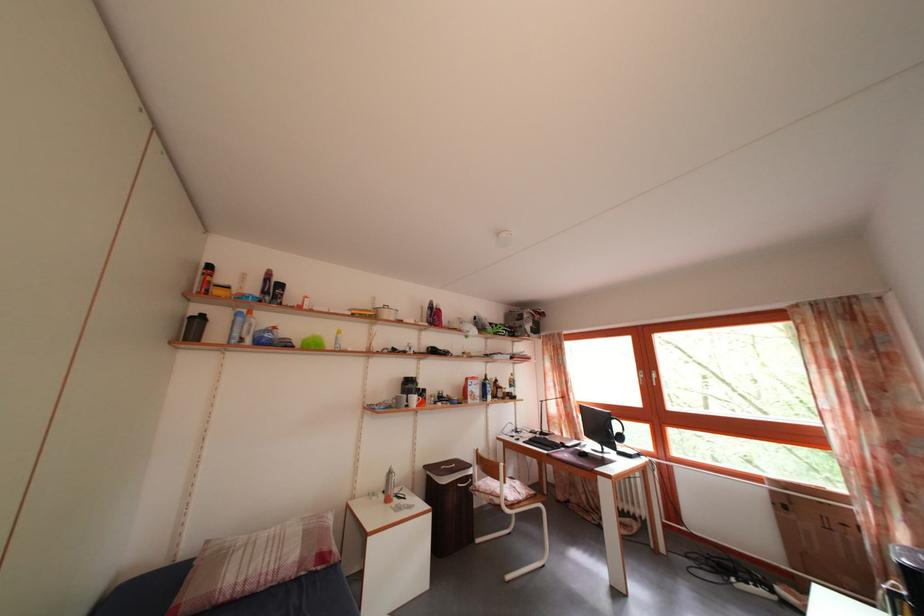
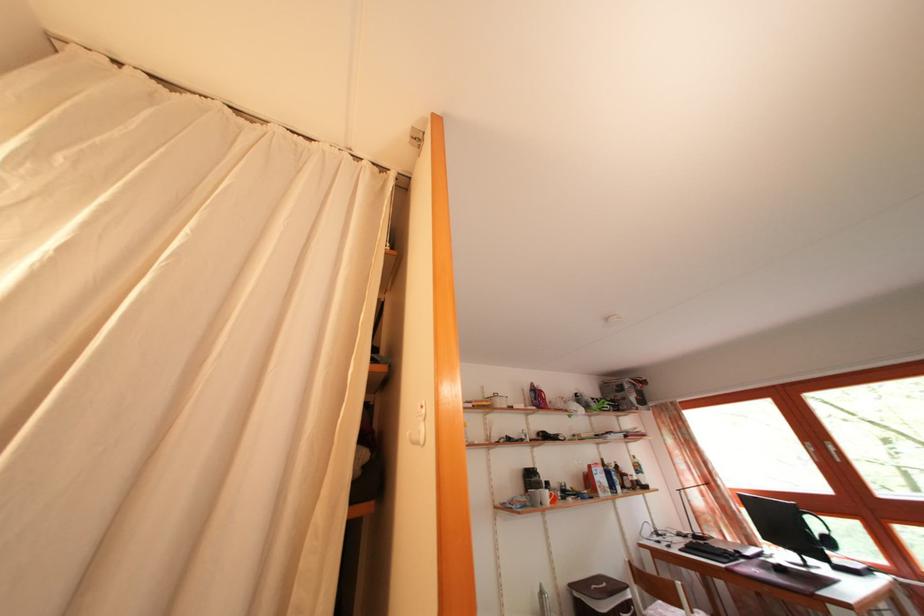
What movement of the cameraman would produce the second image?

The movement direction of the cameraman is left, backward.